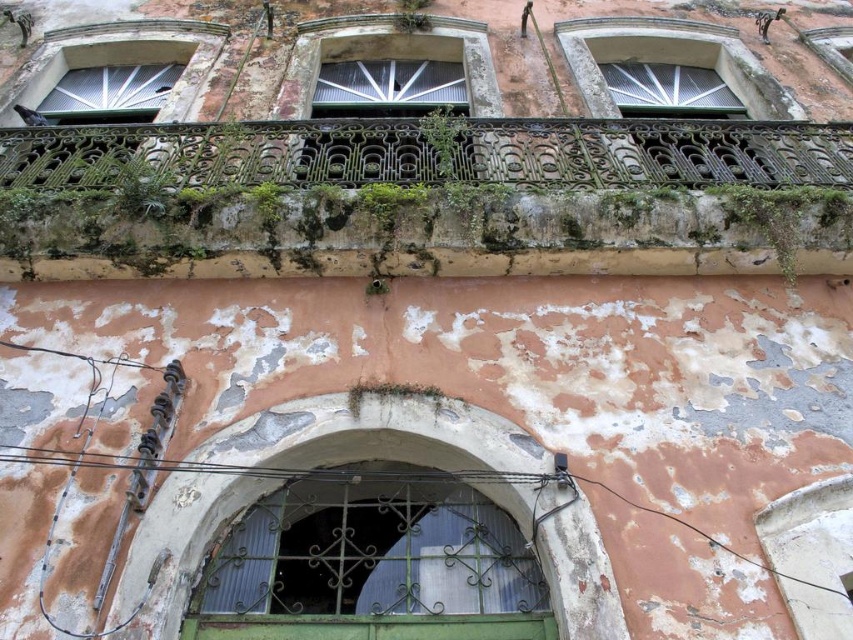
Can you confirm if green mossy metal railing at upper center is thinner than green wrought iron balcony at upper center?

No, green mossy metal railing at upper center is not thinner than green wrought iron balcony at upper center.

Which is above, green mossy metal railing at upper center or green wrought iron balcony at upper center?

Positioned higher is green wrought iron balcony at upper center.

This screenshot has height=640, width=853. Describe the element at coordinates (425, 198) in the screenshot. I see `green mossy metal railing at upper center` at that location.

You are a GUI agent. You are given a task and a screenshot of the screen. Output one action in this format:
    pyautogui.click(x=<x>, y=<y>)
    Task: Click on the green mossy metal railing at upper center
    
    Given the screenshot: What is the action you would take?
    pyautogui.click(x=425, y=198)

Which is more to the left, green wrought iron balcony at upper center or green metal/glass door at center?

Positioned to the left is green wrought iron balcony at upper center.

Is green wrought iron balcony at upper center above green metal/glass door at center?

Yes, green wrought iron balcony at upper center is above green metal/glass door at center.

Is point (225, 148) closer to viewer compared to point (346, 493)?

No, (225, 148) is behind (346, 493).

You are a GUI agent. You are given a task and a screenshot of the screen. Output one action in this format:
    pyautogui.click(x=<x>, y=<y>)
    Task: Click on the green wrought iron balcony at upper center
    This screenshot has width=853, height=640.
    Given the screenshot: What is the action you would take?
    pyautogui.click(x=436, y=152)

Image resolution: width=853 pixels, height=640 pixels. What are the coordinates of `green mossy metal railing at upper center` in the screenshot? It's located at (425, 198).

Does point (352, 202) come closer to viewer compared to point (238, 573)?

No, it is behind (238, 573).

Does point (640, 145) lie in front of point (335, 605)?

That is False.

You are a GUI agent. You are given a task and a screenshot of the screen. Output one action in this format:
    pyautogui.click(x=<x>, y=<y>)
    Task: Click on the green mossy metal railing at upper center
    The image size is (853, 640).
    Given the screenshot: What is the action you would take?
    click(425, 198)